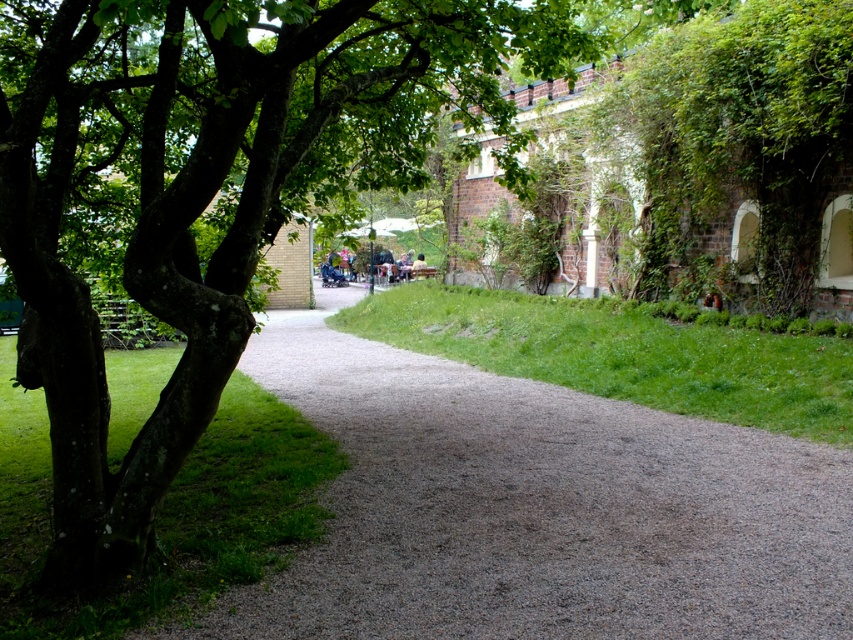
You are standing at the edge of the gravel pathway and want to walk towards the tree on the left. Which green grass area, the green grass at left or the green grass at center, will you step onto first?

The green grass at left is closer to the viewer than the green grass at center, so you will step onto the green grass at left first.

You are standing at the center of the scene and want to walk towards the gray gravel path at center. According to the coordinates provided, in which direction should you move to reach it?

The gray gravel path at center is located at coordinates point (537, 508), so you should move towards the lower right direction to reach it.